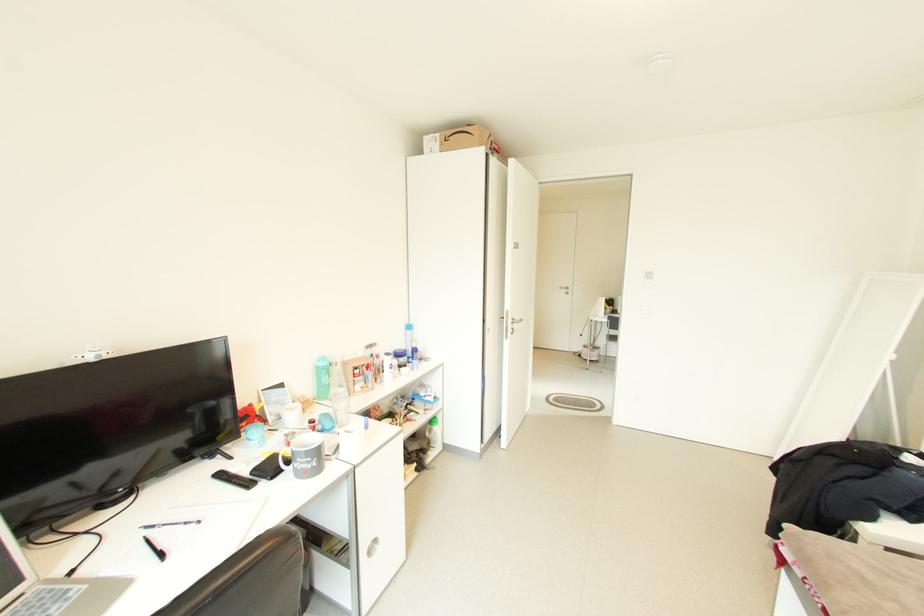
Image resolution: width=924 pixels, height=616 pixels. What do you see at coordinates (371, 546) in the screenshot?
I see `the round cabinet handle` at bounding box center [371, 546].